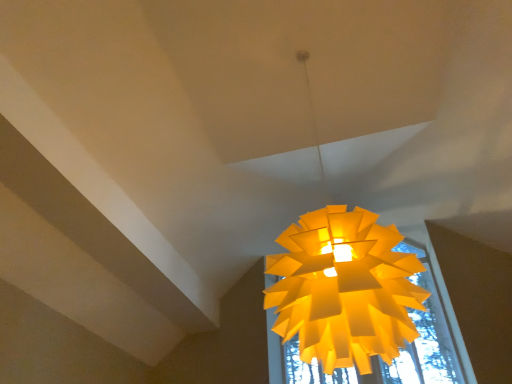
Describe the element at coordinates (343, 289) in the screenshot. I see `matte yellow paper lamp at center` at that location.

What are the coordinates of `matte yellow paper lamp at center` in the screenshot? It's located at click(343, 289).

At what (x,y) coordinates should I click in order to perform the action: click on matte yellow paper lamp at center. Please return your answer as a coordinate pair (x, y). Looking at the image, I should click on (343, 289).